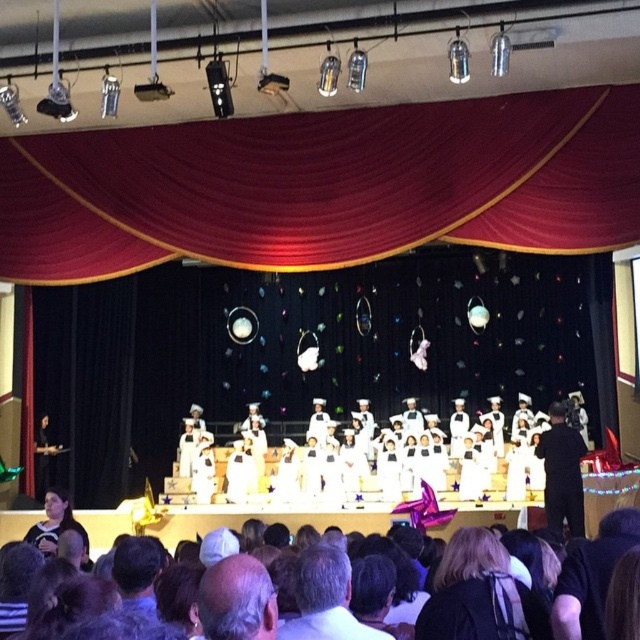
Who is taller, velvet red curtain at upper center or dark brown hair at lower center?

Standing taller between the two is velvet red curtain at upper center.

In order to click on velvet red curtain at upper center in this screenshot , I will do `click(324, 186)`.

Is point (282, 468) behind point (317, 588)?

Yes, point (282, 468) is farther from viewer.

Who is taller, white matte uniform at center or dark brown hair at lower center?

With more height is white matte uniform at center.

Where is `white matte uniform at center`? white matte uniform at center is located at coordinates (332, 467).

Is velvet red curtain at upper center positioned before white matte uniform at center?

No.

Based on the photo, can you confirm if velvet red curtain at upper center is positioned above white matte uniform at center?

Indeed, velvet red curtain at upper center is positioned over white matte uniform at center.

This screenshot has height=640, width=640. What do you see at coordinates (324, 186) in the screenshot?
I see `velvet red curtain at upper center` at bounding box center [324, 186].

Identify the location of velvet red curtain at upper center. The width and height of the screenshot is (640, 640). (324, 186).